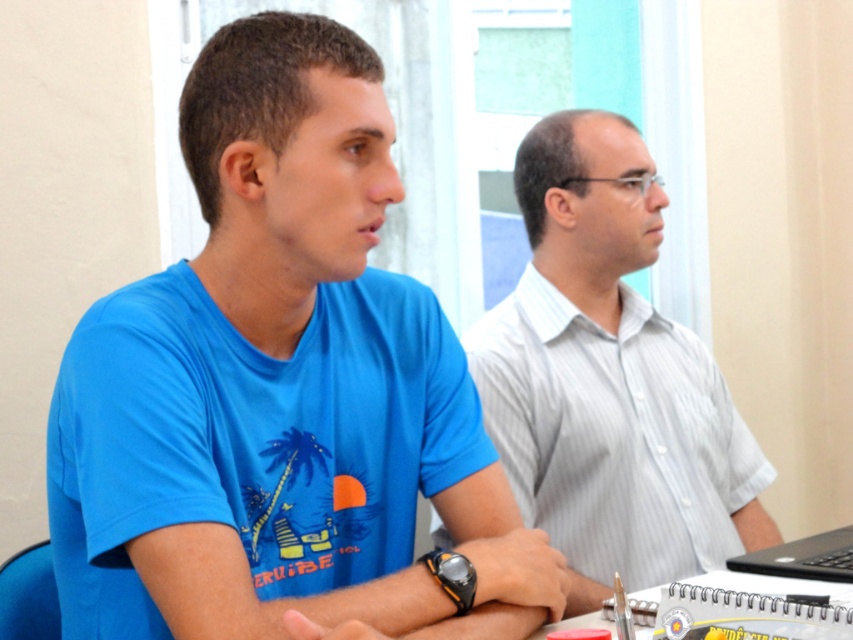
Looking at this image, you are standing in front of the table where the two people are sitting. You want to reach a point that is closer to you. Which point should you choose between point (224, 593) and point (730, 445)?

Point (224, 593) is closer to the viewer than point (730, 445), so you should choose point (224, 593).

Where is the blue cotton shirt at center located in the image?

The blue cotton shirt at center is located at point (281, 388).